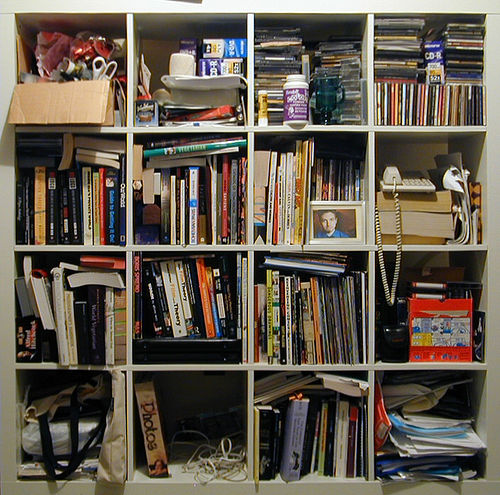
Locate an element on the screen. Image resolution: width=500 pixels, height=495 pixels. stacks and rows of cds is located at coordinates (272, 59), (337, 57), (334, 175), (395, 53), (463, 49), (440, 110), (434, 63), (226, 39).